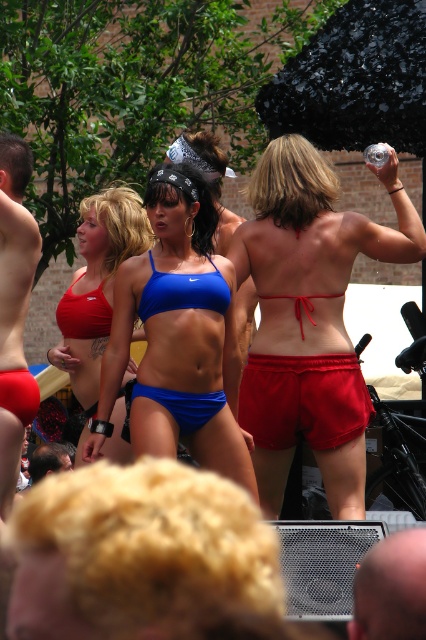
Question: Estimate the real-world distances between objects in this image. Which object is farther from the blue matte bikini top at center?

Choices:
 (A) red satin shorts at upper center
 (B) red fabric shorts at center

Answer: (B)

Question: Can you confirm if red satin shorts at upper center is positioned above matte blue bikini top at center?

Choices:
 (A) no
 (B) yes

Answer: (A)

Question: Which of the following is the farthest from the observer?

Choices:
 (A) matte red bikini top at left
 (B) red fabric shorts at center

Answer: (A)

Question: Does matte blue bikini top at center have a lesser width compared to matte red shorts at left?

Choices:
 (A) no
 (B) yes

Answer: (A)

Question: Is red satin shorts at upper center below matte red bikini top at left?

Choices:
 (A) yes
 (B) no

Answer: (A)

Question: Which object appears farthest from the camera in this image?

Choices:
 (A) matte red shorts at left
 (B) matte blue bikini top at center
 (C) blue matte bikini top at center

Answer: (B)